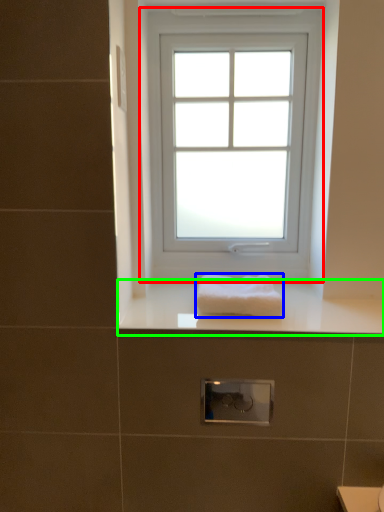
Question: Based on their relative distances, which object is nearer to window (highlighted by a red box)? Choose from towel (highlighted by a blue box) and counter top (highlighted by a green box).

Choices:
 (A) towel
 (B) counter top

Answer: (B)